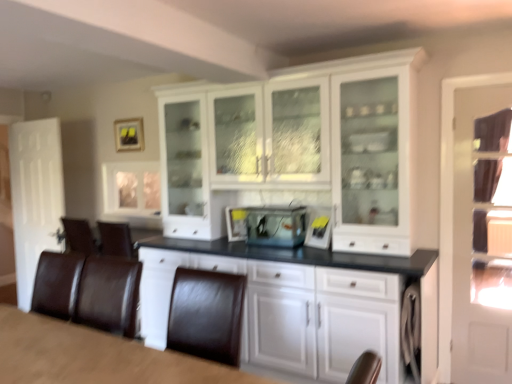
Question: Does matte black picture frame at upper center come behind clear glass fish tank at center?

Choices:
 (A) yes
 (B) no

Answer: (A)

Question: Considering the relative sizes of matte black picture frame at upper center and clear glass fish tank at center in the image provided, is matte black picture frame at upper center shorter than clear glass fish tank at center?

Choices:
 (A) yes
 (B) no

Answer: (B)

Question: From a real-world perspective, is matte black picture frame at upper center physically above clear glass fish tank at center?

Choices:
 (A) yes
 (B) no

Answer: (A)

Question: From the image's perspective, does matte black picture frame at upper center appear higher than clear glass fish tank at center?

Choices:
 (A) yes
 (B) no

Answer: (A)

Question: Considering the relative sizes of matte black picture frame at upper center and clear glass fish tank at center in the image provided, is matte black picture frame at upper center smaller than clear glass fish tank at center?

Choices:
 (A) no
 (B) yes

Answer: (B)

Question: Considering the relative positions of clear glass door at right and matte black picture frame at upper center in the image provided, is clear glass door at right to the left or to the right of matte black picture frame at upper center?

Choices:
 (A) left
 (B) right

Answer: (B)

Question: From the image's perspective, is clear glass door at right positioned above or below matte black picture frame at upper center?

Choices:
 (A) below
 (B) above

Answer: (A)

Question: Is clear glass door at right spatially inside matte black picture frame at upper center, or outside of it?

Choices:
 (A) outside
 (B) inside

Answer: (A)

Question: Does point (504, 114) appear closer or farther from the camera than point (117, 120)?

Choices:
 (A) farther
 (B) closer

Answer: (B)

Question: From the image's perspective, is white glossy cabinet at center positioned above or below clear glass door at right?

Choices:
 (A) below
 (B) above

Answer: (B)

Question: Is white glossy cabinet at center in front of or behind clear glass door at right in the image?

Choices:
 (A) behind
 (B) front

Answer: (B)

Question: From their relative heights in the image, would you say white glossy cabinet at center is taller or shorter than clear glass door at right?

Choices:
 (A) tall
 (B) short

Answer: (A)

Question: Choose the correct answer: Is white glossy cabinet at center inside clear glass door at right or outside it?

Choices:
 (A) outside
 (B) inside

Answer: (A)

Question: Choose the correct answer: Is brown leather table at lower left inside clear glass fish tank at center or outside it?

Choices:
 (A) inside
 (B) outside

Answer: (B)

Question: Is brown leather table at lower left in front of or behind clear glass fish tank at center in the image?

Choices:
 (A) behind
 (B) front

Answer: (B)